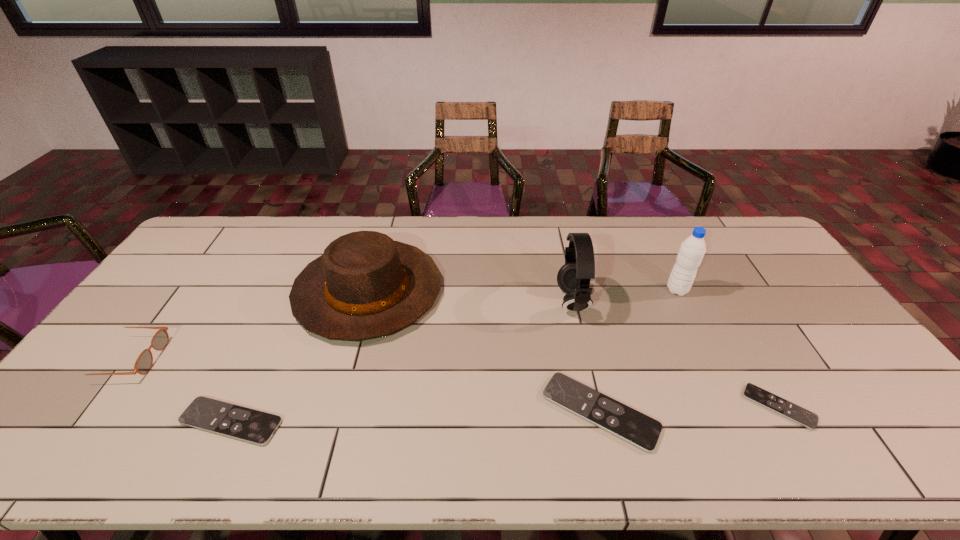
In order to click on object present at the left edge in this screenshot , I will do `click(144, 362)`.

At what (x,y) coordinates should I click in order to perform the action: click on free space at the far edge of the desktop. Please return your answer as a coordinate pair (x, y). Looking at the image, I should click on (401, 239).

Identify the location of vacant position at the near edge of the desktop. The image size is (960, 540). (272, 395).

I want to click on vacant space at the left edge of the desktop, so click(x=215, y=271).

Identify the location of vacant space at the right edge of the desktop. (774, 309).

In the image, there is a desktop. Where is `free region at the far right corner`? Image resolution: width=960 pixels, height=540 pixels. free region at the far right corner is located at coordinates (746, 251).

Locate an element on the screen. The height and width of the screenshot is (540, 960). free space at the near right corner of the desktop is located at coordinates (878, 411).

Image resolution: width=960 pixels, height=540 pixels. Identify the location of vacant space that's between the second shortest remote control and the shortest object. (505, 414).

At what (x,y) coordinates should I click in order to perform the action: click on vacant space in between the water bottle and the second shortest remote control. Please return your answer as a coordinate pair (x, y). Looking at the image, I should click on (454, 356).

Image resolution: width=960 pixels, height=540 pixels. I want to click on unoccupied position between the sixth tallest object and the third tallest object, so click(x=300, y=356).